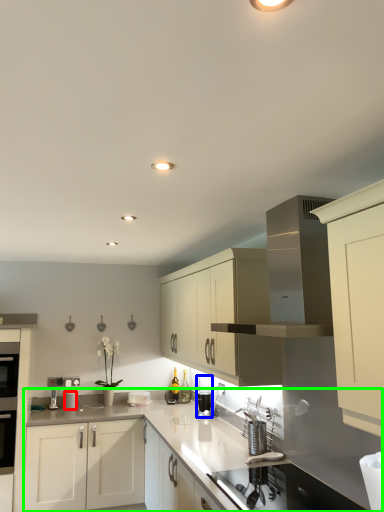
Question: Which is farther away from appliance (highlighted by a red box)? appliance (highlighted by a blue box) or countertop (highlighted by a green box)?

Choices:
 (A) appliance
 (B) countertop

Answer: (A)